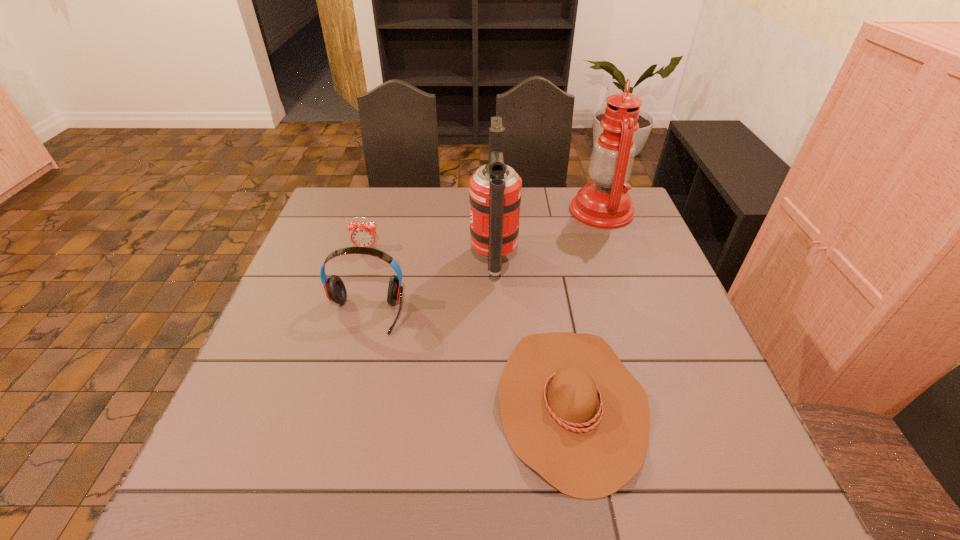
Where is `oil lamp`? Image resolution: width=960 pixels, height=540 pixels. oil lamp is located at coordinates (605, 203).

I want to click on fire extinguisher, so click(x=495, y=188).

Where is `the third shortest object`? the third shortest object is located at coordinates (334, 287).

Where is `alarm clock`? This screenshot has height=540, width=960. alarm clock is located at coordinates (363, 235).

Identify the location of cowboy hat. The height and width of the screenshot is (540, 960). (570, 409).

You are a GUI agent. You are given a task and a screenshot of the screen. Output one action in this format:
    pyautogui.click(x=<x>, y=<y>)
    Task: Click on the vacant space located on the left of the oil lamp
    The image size is (960, 540).
    Given the screenshot: What is the action you would take?
    pyautogui.click(x=464, y=211)

Where is `free space located on the front label side of the fire extinguisher`? free space located on the front label side of the fire extinguisher is located at coordinates (330, 260).

Identify the location of free space located on the front label side of the fire extinguisher. (370, 260).

Where is `vacant space situated on the front label side of the fire extinguisher`? The height and width of the screenshot is (540, 960). vacant space situated on the front label side of the fire extinguisher is located at coordinates (442, 260).

I want to click on free point located 0.090m with the microphone attached to the side of the headset, so click(350, 367).